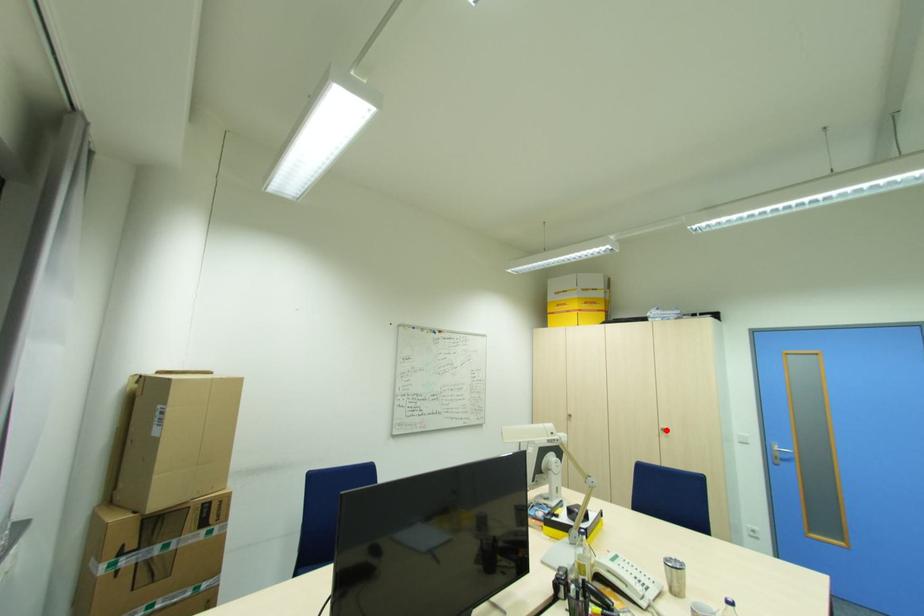
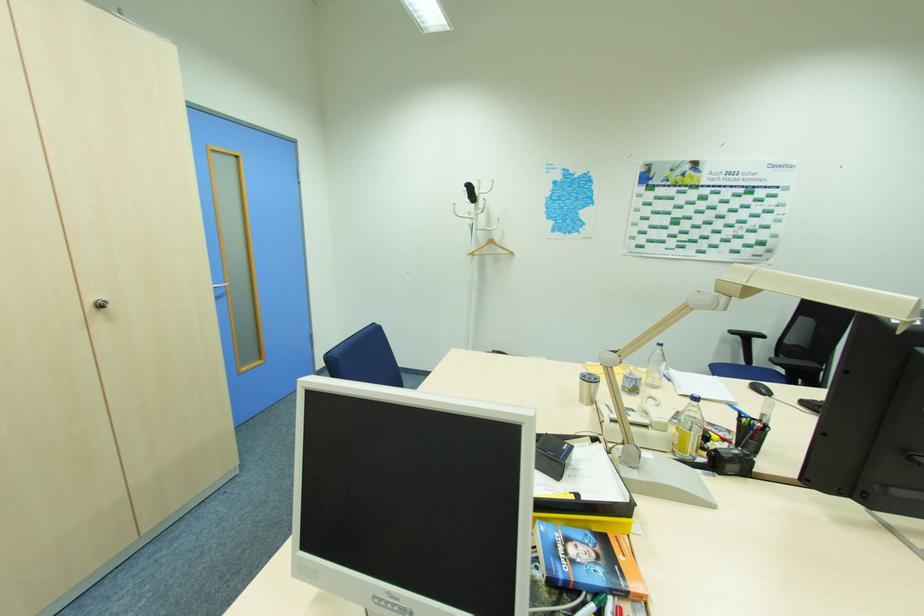
In the second image, find the point that corresponds to the highlighted location in the first image.

(103, 306)